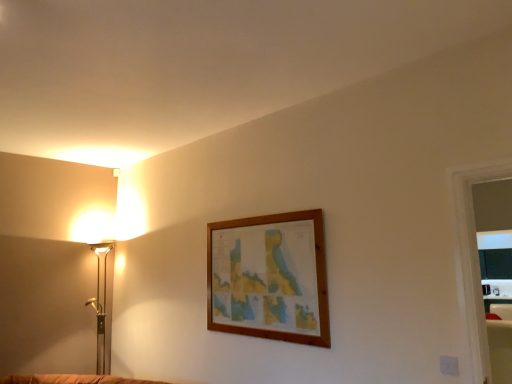
What is the approximate width of gold metallic floor lamp at left?

22.24 inches.

You are a GUI agent. You are given a task and a screenshot of the screen. Output one action in this format:
    pyautogui.click(x=<x>, y=<y>)
    Task: Click on the gold metallic floor lamp at left
    
    Given the screenshot: What is the action you would take?
    pyautogui.click(x=97, y=271)

Measure the distance between gold metallic floor lamp at left and camera.

gold metallic floor lamp at left is 4.22 meters away from camera.

The height and width of the screenshot is (384, 512). Describe the element at coordinates (97, 271) in the screenshot. I see `gold metallic floor lamp at left` at that location.

Image resolution: width=512 pixels, height=384 pixels. What are the coordinates of `gold metallic floor lamp at left` in the screenshot? It's located at (97, 271).